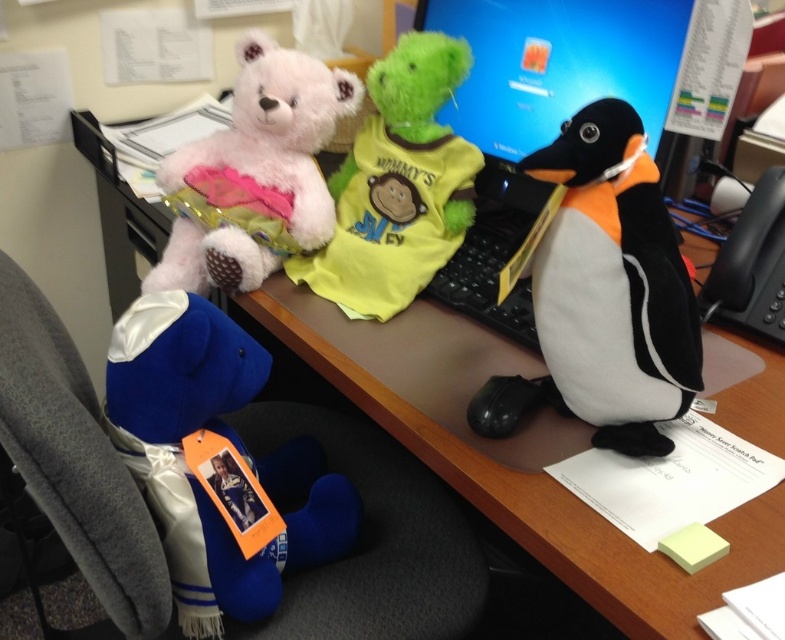
Does blue satin teddy bear at lower left have a greater height compared to fluffy white teddy bear at upper left?

No, blue satin teddy bear at lower left is not taller than fluffy white teddy bear at upper left.

Who is more forward, (199,381) or (159,284)?

Point (199,381)

At what (x,y) coordinates should I click in order to perform the action: click on blue satin teddy bear at lower left. Please return your answer as a coordinate pair (x, y). This screenshot has width=785, height=640. Looking at the image, I should click on (232, 445).

Can you confirm if black plush penguin at right is positioned below fluffy white teddy bear at upper left?

Correct, black plush penguin at right is located below fluffy white teddy bear at upper left.

Is black plush penguin at right thinner than fluffy white teddy bear at upper left?

Indeed, black plush penguin at right has a lesser width compared to fluffy white teddy bear at upper left.

Where is `black plush penguin at right`? black plush penguin at right is located at coordinates (612, 284).

Is point (250, 356) positioned behind point (535, 307)?

Yes, point (250, 356) is farther from viewer.

This screenshot has width=785, height=640. I want to click on blue satin teddy bear at lower left, so click(232, 445).